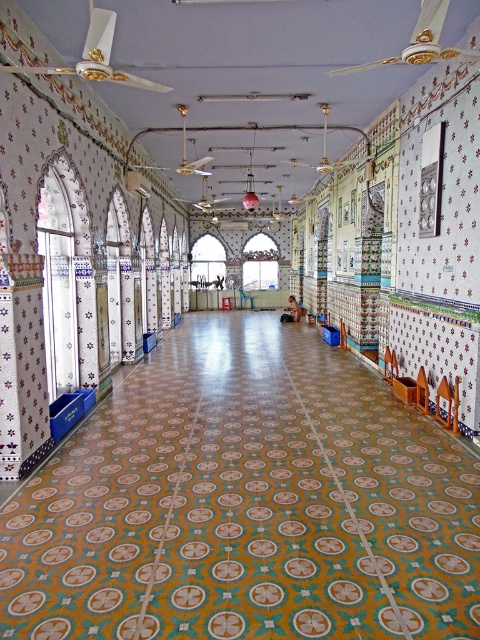
Question: Can you confirm if wooden chair at lower right is smaller than light blue plastic chair at center?

Choices:
 (A) yes
 (B) no

Answer: (A)

Question: Does wooden chair at center have a lesser width compared to yellow plastic chair at center?

Choices:
 (A) no
 (B) yes

Answer: (B)

Question: Which point is closer to the camera?

Choices:
 (A) (241, 301)
 (B) (419, 404)

Answer: (B)

Question: Among these points, which one is farthest from the camera?

Choices:
 (A) (419, 403)
 (B) (383, 378)
 (C) (451, 397)

Answer: (B)

Question: Is wooden chair at center further to the viewer compared to light blue plastic chair at center?

Choices:
 (A) yes
 (B) no

Answer: (B)

Question: Which object is the closest to the wooden chair at center?

Choices:
 (A) yellow plastic chair at center
 (B) wooden chair at lower right
 (C) light blue plastic chair at center

Answer: (B)